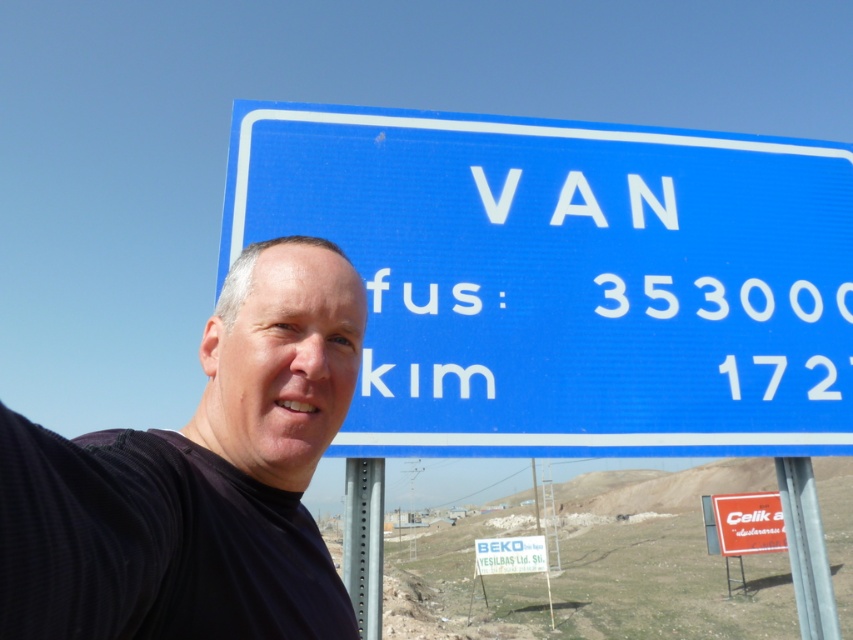
Question: Does metallic pole at center have a lesser width compared to white plastic sign at upper center?

Choices:
 (A) yes
 (B) no

Answer: (A)

Question: Does blue plastic sign at upper center have a larger size compared to white plastic sign at lower right?

Choices:
 (A) no
 (B) yes

Answer: (A)

Question: Estimate the real-world distances between objects in this image. Which object is closer to the white plastic sign at lower right?

Choices:
 (A) white plastic sign at upper center
 (B) metallic pole at center
 (C) metallic gray pole at right
 (D) blue plastic sign at upper center

Answer: (A)

Question: Which is nearer to the metallic gray pole at right?

Choices:
 (A) metallic pole at center
 (B) black fabric at left
 (C) white plastic sign at lower right
 (D) white plastic sign at upper center

Answer: (A)

Question: Estimate the real-world distances between objects in this image. Which object is closer to the blue plastic sign at upper center?

Choices:
 (A) metallic pole at center
 (B) white plastic sign at upper center

Answer: (A)

Question: Can you confirm if black fabric at left is wider than metallic pole at center?

Choices:
 (A) no
 (B) yes

Answer: (B)